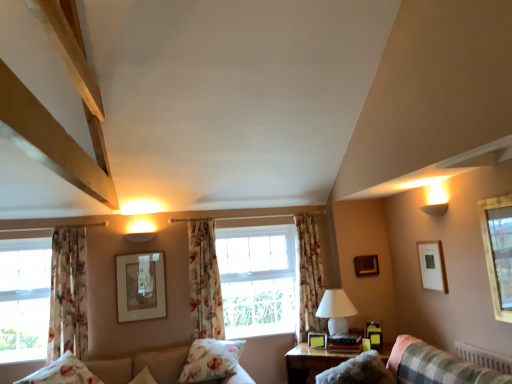
Question: From a real-world perspective, does white glossy table lamp at center-right sit lower than clear glass window at upper right?

Choices:
 (A) no
 (B) yes

Answer: (B)

Question: Can you confirm if white glossy table lamp at center-right is shorter than clear glass window at upper right?

Choices:
 (A) no
 (B) yes

Answer: (B)

Question: Can you confirm if white glossy table lamp at center-right is wider than clear glass window at upper right?

Choices:
 (A) no
 (B) yes

Answer: (B)

Question: From the image's perspective, would you say white glossy table lamp at center-right is positioned over clear glass window at upper right?

Choices:
 (A) no
 (B) yes

Answer: (A)

Question: Considering the relative sizes of white glossy table lamp at center-right and clear glass window at upper right in the image provided, is white glossy table lamp at center-right taller than clear glass window at upper right?

Choices:
 (A) no
 (B) yes

Answer: (A)

Question: Is wooden picture frame at upper right, placed as the fourth picture frame when sorted from left to right, situated inside white glossy table lamp at center-right or outside?

Choices:
 (A) inside
 (B) outside

Answer: (B)

Question: Looking at the image, does wooden picture frame at upper right, the 2th picture frame when ordered from right to left, seem bigger or smaller compared to white glossy table lamp at center-right?

Choices:
 (A) big
 (B) small

Answer: (B)

Question: From the image's perspective, relative to white glossy table lamp at center-right, is wooden picture frame at upper right, placed as the fourth picture frame when sorted from left to right, above or below?

Choices:
 (A) above
 (B) below

Answer: (A)

Question: Is point (357, 264) positioned closer to the camera than point (329, 307)?

Choices:
 (A) closer
 (B) farther

Answer: (B)

Question: From a real-world perspective, relative to floral fabric pillow at lower left, marked as the 1th pillow in a left-to-right arrangement, is matte white picture frame at upper right, which appears as the fifth picture frame when viewed from the back, vertically above or below?

Choices:
 (A) below
 (B) above

Answer: (B)

Question: Do you think matte white picture frame at upper right, which appears as the fifth picture frame when viewed from the back, is within floral fabric pillow at lower left, acting as the second pillow starting from the right, or outside of it?

Choices:
 (A) inside
 (B) outside

Answer: (B)

Question: From the image's perspective, is matte white picture frame at upper right, the first picture frame when ordered from front to back, located above or below floral fabric pillow at lower left, acting as the second pillow starting from the right?

Choices:
 (A) above
 (B) below

Answer: (A)

Question: In the image, is matte white picture frame at upper right, which is the 1th picture frame from right to left, on the left side or the right side of floral fabric pillow at lower left, acting as the second pillow starting from the right?

Choices:
 (A) left
 (B) right

Answer: (B)

Question: From the image's perspective, is floral fabric curtain at center, the 1th curtain from the right, above or below matte gold picture frame at center, the fourth picture frame viewed from the front?

Choices:
 (A) below
 (B) above

Answer: (A)

Question: Is floral fabric curtain at center, which is the third curtain from left to right, to the left or to the right of matte gold picture frame at center, which is the fifth picture frame in right-to-left order, in the image?

Choices:
 (A) left
 (B) right

Answer: (B)